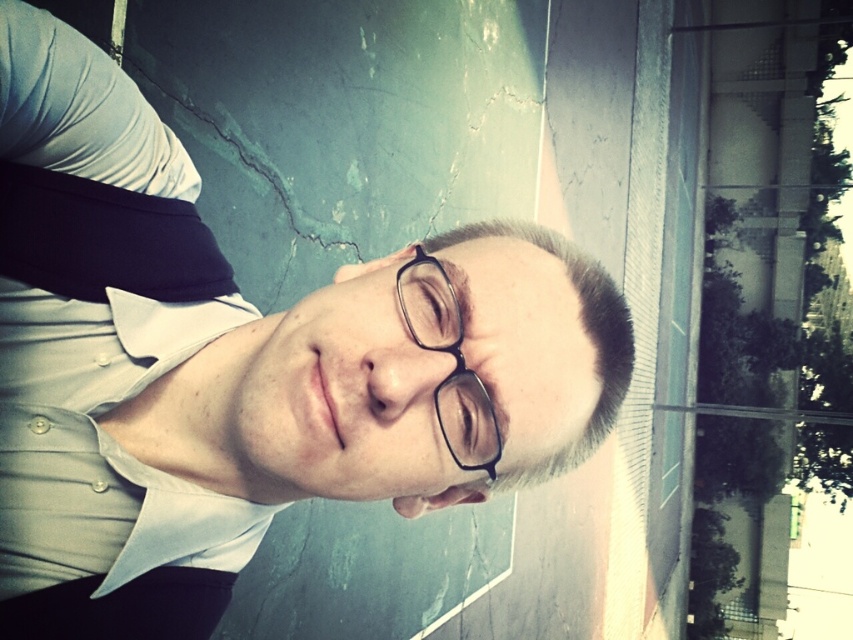
How far apart are white cotton dress shirt at center and black plastic glasses at center?

white cotton dress shirt at center is 10.45 inches away from black plastic glasses at center.

Who is higher up, white cotton dress shirt at center or black plastic glasses at center?

Positioned higher is white cotton dress shirt at center.

Identify the location of white cotton dress shirt at center. This screenshot has width=853, height=640. (99, 352).

Is white shirt at center positioned behind black plastic glasses at center?

No, white shirt at center is closer to the viewer.

Does point (42, 618) lie in front of point (397, 291)?

No, it is behind (397, 291).

You are a GUI agent. You are given a task and a screenshot of the screen. Output one action in this format:
    pyautogui.click(x=<x>, y=<y>)
    Task: Click on the white shirt at center
    The height and width of the screenshot is (640, 853).
    Given the screenshot: What is the action you would take?
    pyautogui.click(x=241, y=364)

Where is `white shirt at center`? This screenshot has width=853, height=640. white shirt at center is located at coordinates (241, 364).

Describe the element at coordinates (241, 364) in the screenshot. I see `white shirt at center` at that location.

Between point (572, 436) and point (6, 132), which one is positioned in front?

Point (6, 132) is in front.

Identify the location of white shirt at center. (241, 364).